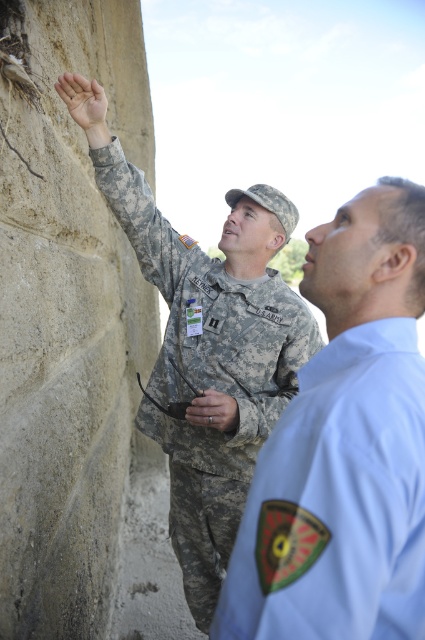
You are a photographer trying to capture a group photo of the light blue uniform at upper right and the camouflage fabric uniform at upper left. Based on their current positions, which person should you ask to move closer to the other to ensure both are equally visible in the photo?

The light blue uniform at upper right occupies less space than camouflage fabric uniform at upper left, so the photographer should ask the light blue uniform at upper right to move closer to the camouflage fabric uniform at upper left to balance their visibility in the photo.

You are a photographer trying to capture a group photo of the light blue uniform at upper right and the camouflage fabric uniform at upper left. Based on their current positions, which direction should you position yourself to ensure both are framed properly?

You should position yourself to the left of the camouflage fabric uniform at upper left to ensure both the light blue uniform at upper right and the camouflage fabric uniform at upper left are framed properly, as the light blue uniform at upper right is to the right of the camouflage fabric uniform at upper left.

In the scene shown: You are standing 1 meter away from the large stone wall. You want to touch the point at coordinates point (266, 564) on the wall. Can you reach it without moving closer?

The point (266, 564) is 90.35 centimeters away from the viewer. Since you are standing 1 meter away from the wall, which is 100 centimeters, you can reach it without moving closer because the point is within your reach distance.